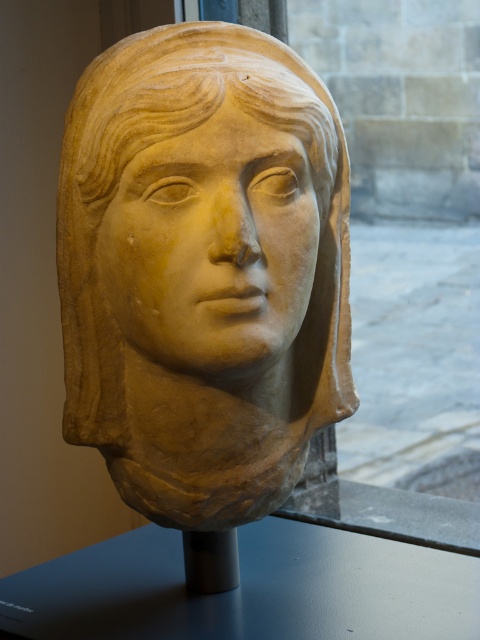
Which is below, beige stone bust at center or smooth beige stone face at center?

Positioned lower is beige stone bust at center.

Where is `beige stone bust at center`? This screenshot has width=480, height=640. beige stone bust at center is located at coordinates (203, 269).